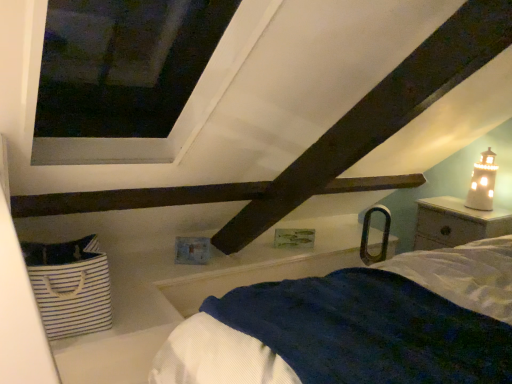
Question: Does white wood nightstand at right have a smaller size compared to white striped fabric basket at lower left?

Choices:
 (A) no
 (B) yes

Answer: (A)

Question: From a real-world perspective, is white wood nightstand at right positioned under white striped fabric basket at lower left based on gravity?

Choices:
 (A) no
 (B) yes

Answer: (A)

Question: Is white wood nightstand at right positioned far away from white striped fabric basket at lower left?

Choices:
 (A) no
 (B) yes

Answer: (B)

Question: Does white wood nightstand at right have a larger size compared to white striped fabric basket at lower left?

Choices:
 (A) yes
 (B) no

Answer: (A)

Question: From a real-world perspective, does white wood nightstand at right stand above white striped fabric basket at lower left?

Choices:
 (A) yes
 (B) no

Answer: (A)

Question: From the image's perspective, is white ceramic lighthouse at upper right positioned above or below white wood nightstand at right?

Choices:
 (A) below
 (B) above

Answer: (B)

Question: Considering their positions, is white ceramic lighthouse at upper right located in front of or behind white wood nightstand at right?

Choices:
 (A) front
 (B) behind

Answer: (B)

Question: From a real-world perspective, relative to white wood nightstand at right, is white ceramic lighthouse at upper right vertically above or below?

Choices:
 (A) below
 (B) above

Answer: (B)

Question: Considering the positions of white ceramic lighthouse at upper right and white wood nightstand at right in the image, is white ceramic lighthouse at upper right taller or shorter than white wood nightstand at right?

Choices:
 (A) short
 (B) tall

Answer: (A)

Question: From a real-world perspective, is white wood nightstand at right above or below white ceramic lighthouse at upper right?

Choices:
 (A) above
 (B) below

Answer: (B)

Question: Is white wood nightstand at right inside or outside of white ceramic lighthouse at upper right?

Choices:
 (A) inside
 (B) outside

Answer: (B)

Question: In terms of width, does white wood nightstand at right look wider or thinner when compared to white ceramic lighthouse at upper right?

Choices:
 (A) thin
 (B) wide

Answer: (B)

Question: Is white wood nightstand at right to the left or to the right of white ceramic lighthouse at upper right in the image?

Choices:
 (A) left
 (B) right

Answer: (A)

Question: From the image's perspective, is white ceramic lighthouse at upper right located above or below white striped fabric basket at lower left?

Choices:
 (A) below
 (B) above

Answer: (B)

Question: In terms of width, does white ceramic lighthouse at upper right look wider or thinner when compared to white striped fabric basket at lower left?

Choices:
 (A) thin
 (B) wide

Answer: (A)